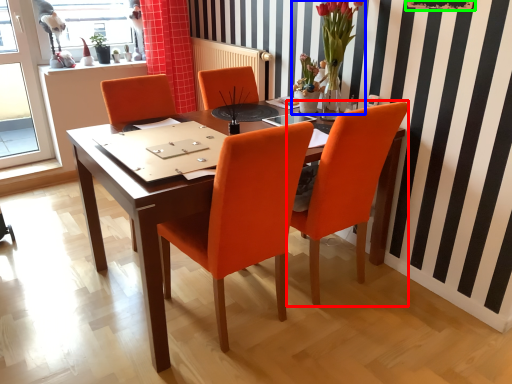
Question: Which object is the closest to the chair (highlighted by a red box)? Choose among these: floral arrangement (highlighted by a blue box) or bulletin board (highlighted by a green box).

Choices:
 (A) floral arrangement
 (B) bulletin board

Answer: (A)